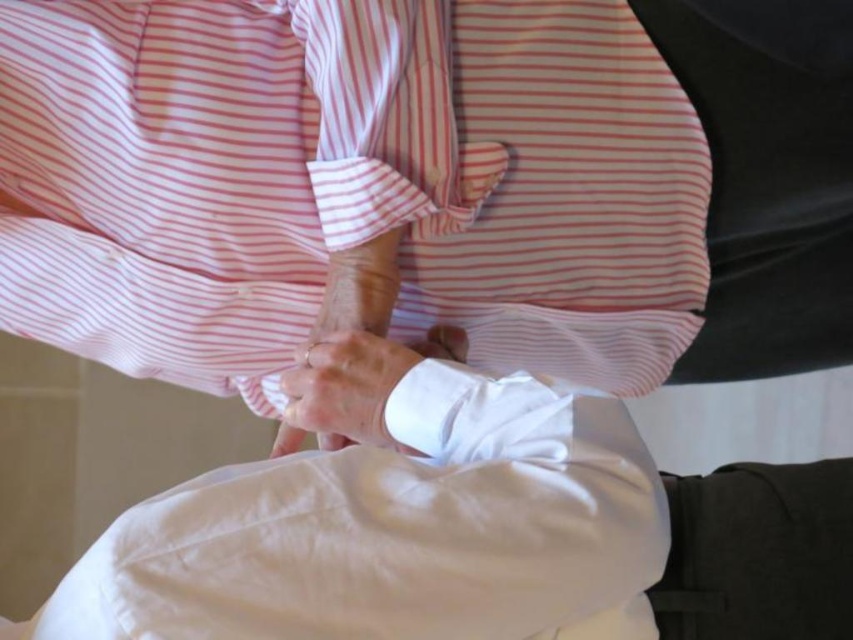
Based on the scene described, which object is wider, the pink striped shirt at center or the white satin hand at center?

The pink striped shirt at center is wider than the white satin hand at center according to the description.

You are a patient in the clinic and you see two points marked on your body during an examination. The points are labeled as point (549, 83) and point (302, 381). Which point is closer to your back?

Point (549, 83) is behind point (302, 381), so it is closer to your back.